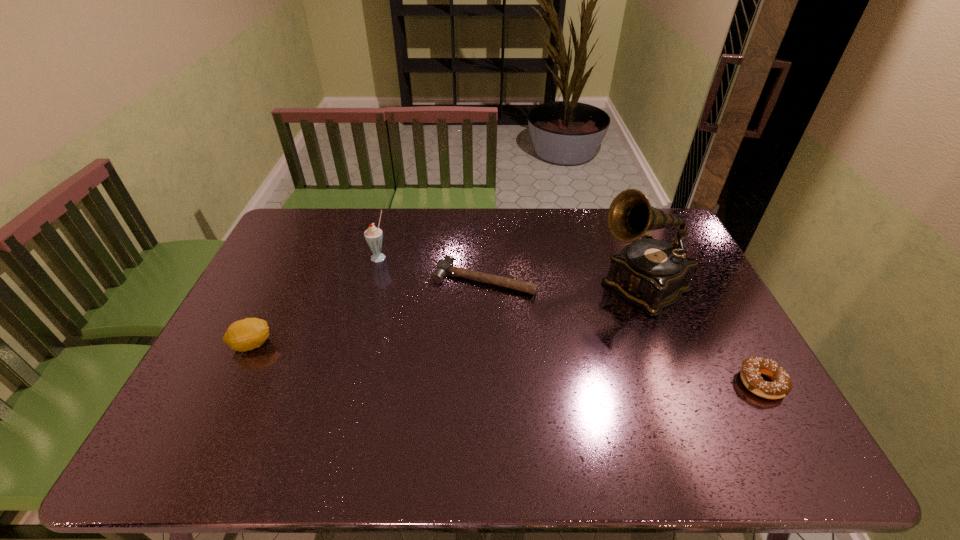
Find the location of `object located in the near edge section of the desktop`. object located in the near edge section of the desktop is located at coordinates (752, 368).

Where is `object located in the left edge section of the desktop`? object located in the left edge section of the desktop is located at coordinates (247, 334).

Find the location of a particular element. The height and width of the screenshot is (540, 960). doughnut at the right edge is located at coordinates (752, 368).

Locate an element on the screen. This screenshot has height=540, width=960. phonograph record at the right edge is located at coordinates (653, 274).

Where is `object located in the near right corner section of the desktop`? Image resolution: width=960 pixels, height=540 pixels. object located in the near right corner section of the desktop is located at coordinates (752, 368).

The height and width of the screenshot is (540, 960). I want to click on free space at the far edge of the desktop, so click(408, 234).

You are a GUI agent. You are given a task and a screenshot of the screen. Output one action in this format:
    pyautogui.click(x=<x>, y=<y>)
    Task: Click on the free space at the near edge of the desktop
    
    Given the screenshot: What is the action you would take?
    pyautogui.click(x=531, y=408)

Locate an element on the screen. Image resolution: width=960 pixels, height=540 pixels. vacant area at the left edge of the desktop is located at coordinates (270, 254).

Locate an element on the screen. This screenshot has height=540, width=960. empty space that is in between the second tallest object and the lemon is located at coordinates (315, 300).

Locate an element on the screen. Image resolution: width=960 pixels, height=540 pixels. vacant space that's between the third tallest object and the phonograph record is located at coordinates (446, 315).